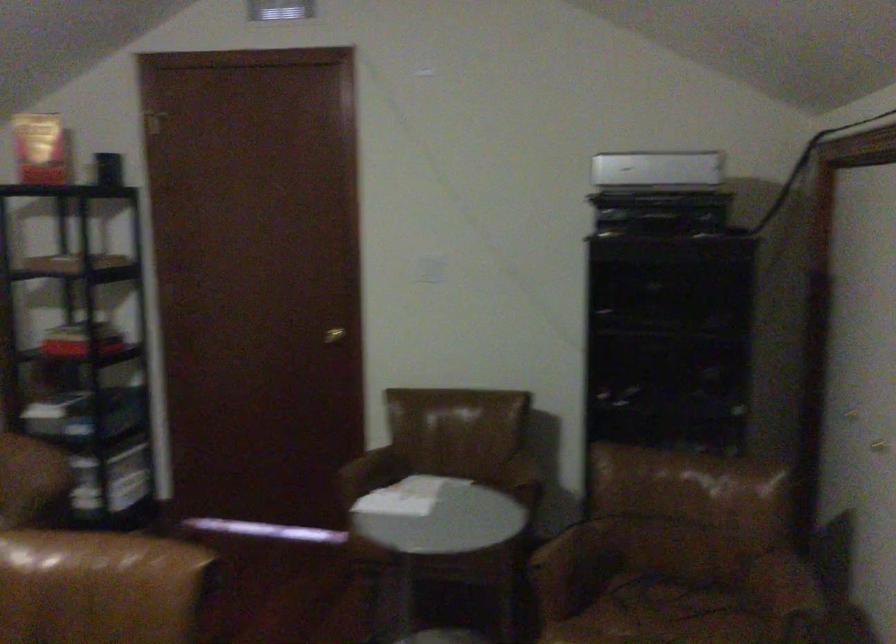
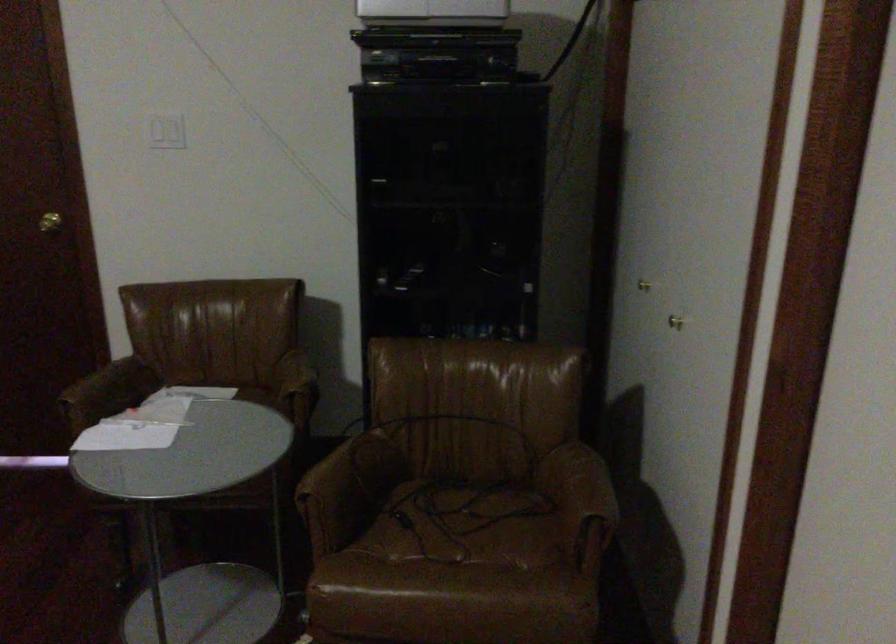
Where in the second image is the point corresponding to [337,337] from the first image?

(49, 222)